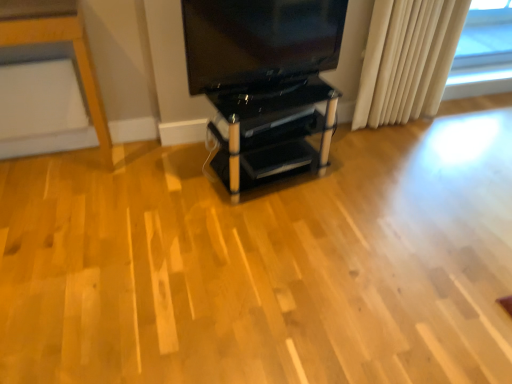
Question: Looking at their shapes, would you say white fabric curtain at right is wider or thinner than matte black tv at upper center?

Choices:
 (A) wide
 (B) thin

Answer: (A)

Question: Is white fabric curtain at right to the left or to the right of matte black tv at upper center in the image?

Choices:
 (A) right
 (B) left

Answer: (A)

Question: Which object is positioned farthest from the white fabric curtain at right?

Choices:
 (A) black glass shelving unit at center
 (B) matte black tv at upper center

Answer: (A)

Question: Based on their relative distances, which object is farther from the white fabric curtain at right?

Choices:
 (A) matte black tv at upper center
 (B) black glass shelving unit at center

Answer: (B)